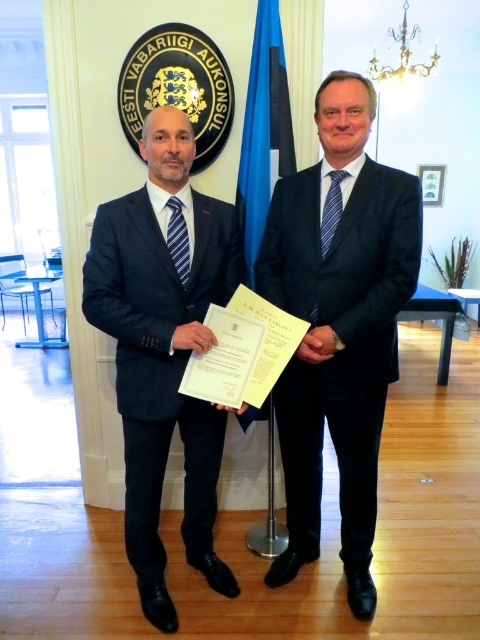
Who is lower down, dark blue suit at center or matte black suit at center?

matte black suit at center is below.

Can you confirm if dark blue suit at center is shorter than matte black suit at center?

No.

The width and height of the screenshot is (480, 640). Describe the element at coordinates (338, 323) in the screenshot. I see `dark blue suit at center` at that location.

Find the location of a particular element. dark blue suit at center is located at coordinates (338, 323).